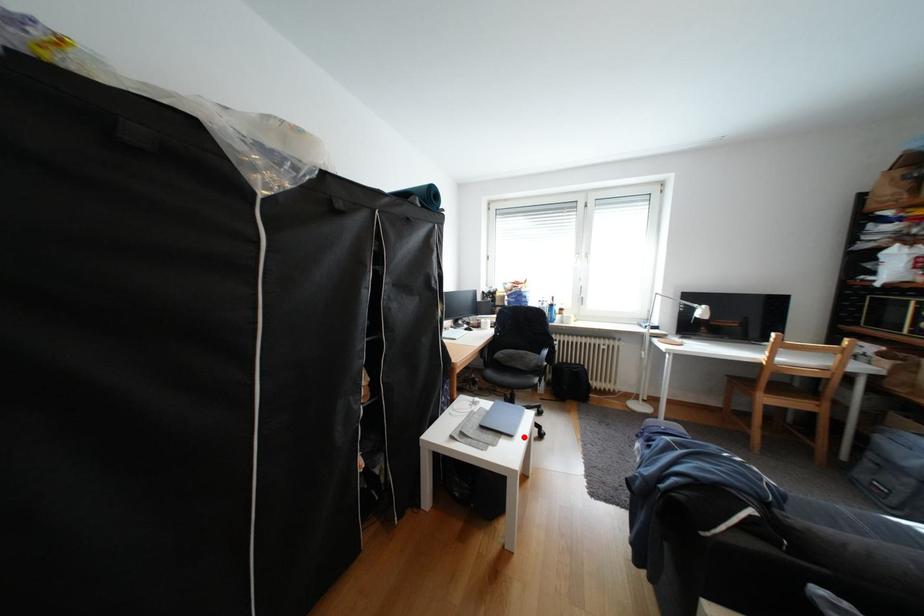
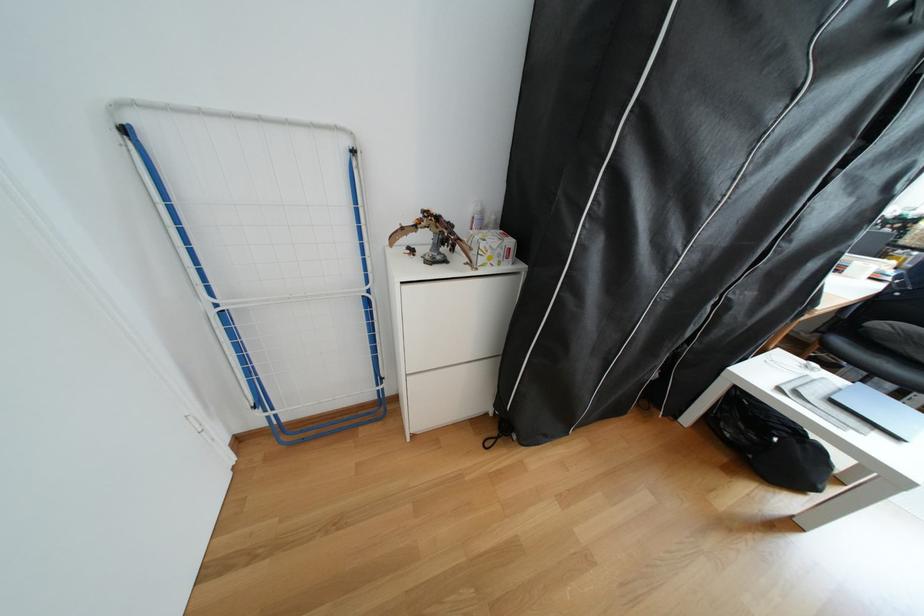
In the second image, find the point that corresponds to the highlighted location in the first image.

(908, 439)